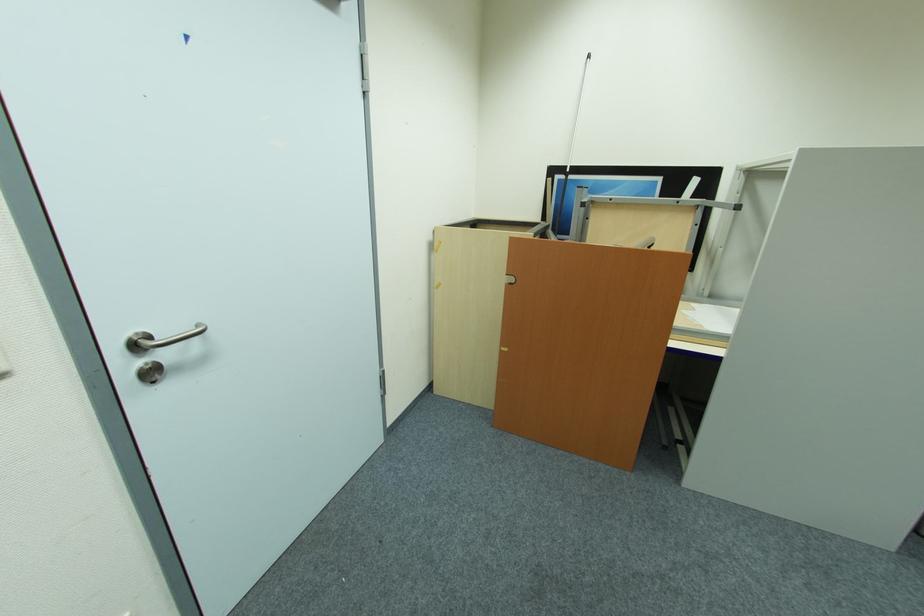
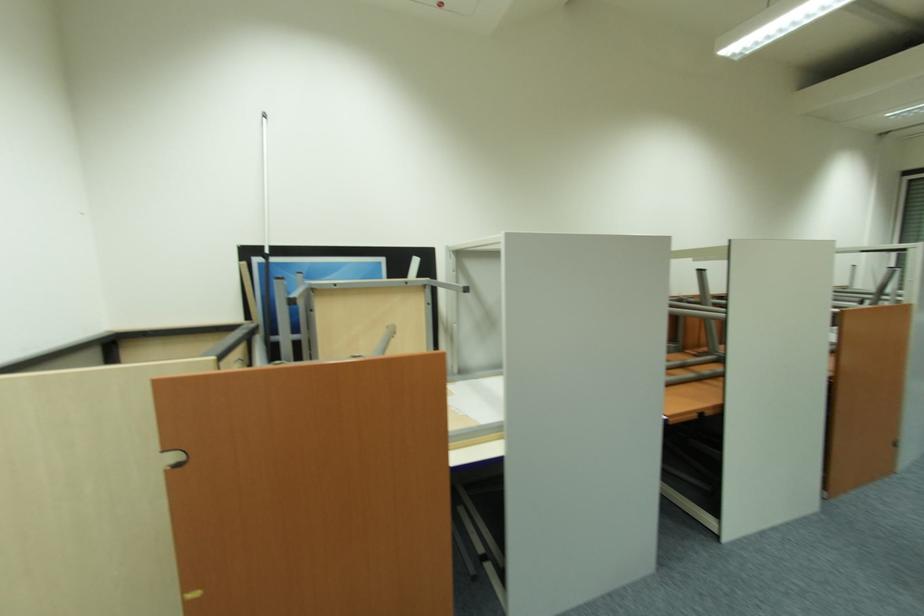
Question: How did the camera likely rotate?

Choices:
 (A) Left
 (B) Right
 (C) Up
 (D) Down

Answer: (B)